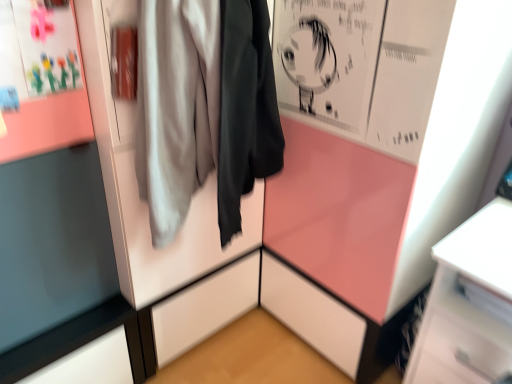
Question: From the image's perspective, is matte paper poster at upper left located above or below matte gray jacket at center?

Choices:
 (A) below
 (B) above

Answer: (B)

Question: Is matte paper poster at upper left inside or outside of matte gray jacket at center?

Choices:
 (A) inside
 (B) outside

Answer: (B)

Question: Looking at their shapes, would you say matte paper poster at upper left is wider or thinner than matte gray jacket at center?

Choices:
 (A) thin
 (B) wide

Answer: (A)

Question: In the image, is matte gray jacket at center positioned in front of or behind matte paper poster at upper left?

Choices:
 (A) front
 (B) behind

Answer: (A)

Question: Looking at their shapes, would you say matte gray jacket at center is wider or thinner than matte paper poster at upper left?

Choices:
 (A) wide
 (B) thin

Answer: (A)

Question: From the image's perspective, relative to matte paper poster at upper left, is matte gray jacket at center above or below?

Choices:
 (A) below
 (B) above

Answer: (A)

Question: Is point (189, 196) closer or farther from the camera than point (68, 122)?

Choices:
 (A) closer
 (B) farther

Answer: (B)